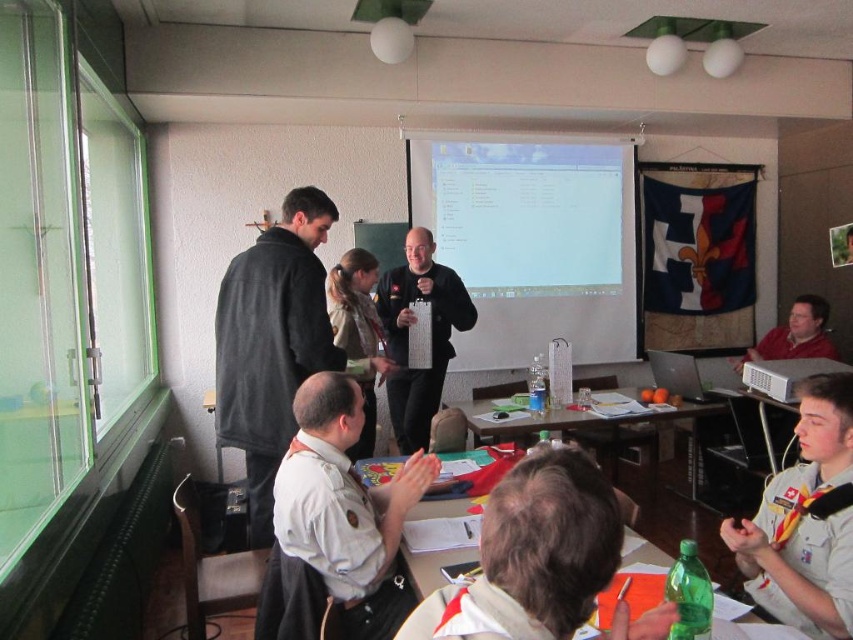
You are organizing a clothing donation drive and need to categorize items by size. You have a dark gray fleece jacket at upper left and a white uniform shirt at lower right. Which item should you place in the large size bin?

The dark gray fleece jacket at upper left has a larger size compared to the white uniform shirt at lower right, so it should be placed in the large size bin.

You are a photographer setting up for a group photo in the classroom. You have two jackets, the dark gray fleece jacket at upper left and the black matte jacket at center. Which jacket should you place on the back row to ensure it doesn

The dark gray fleece jacket at upper left is much taller than the black matte jacket at center, so placing it in the back row would prevent it from blocking others in front.